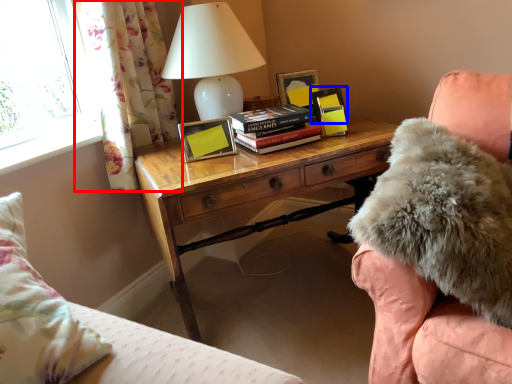
Question: Which object is closer to the camera taking this photo, curtain (highlighted by a red box) or picture frame (highlighted by a blue box)?

Choices:
 (A) curtain
 (B) picture frame

Answer: (A)